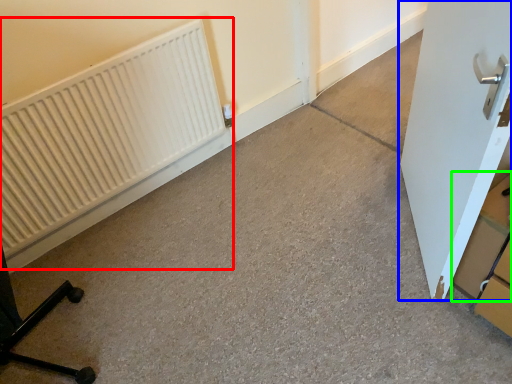
Question: Which object is the closest to the radiator (highlighted by a red box)? Choose among these: door (highlighted by a blue box) or cardboard box (highlighted by a green box).

Choices:
 (A) door
 (B) cardboard box

Answer: (A)